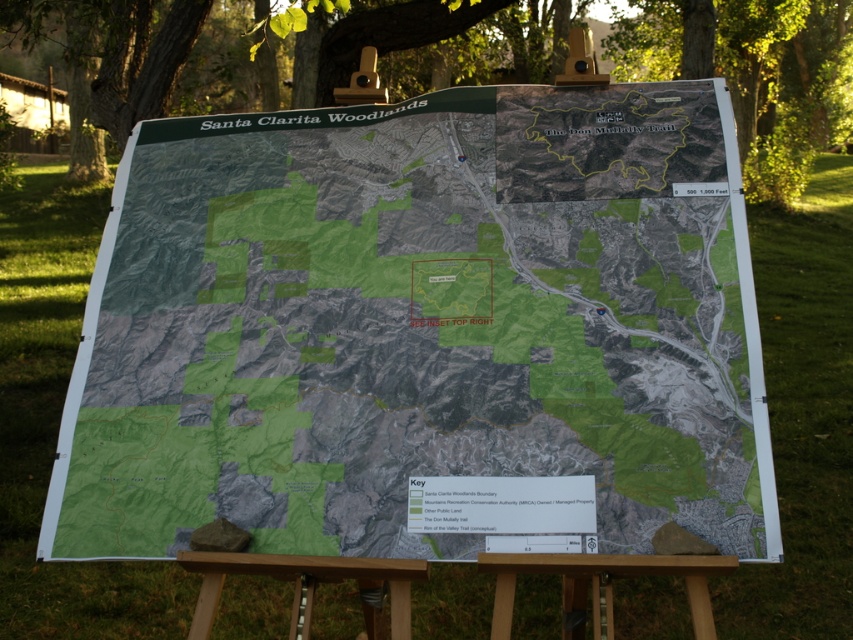
Who is lower down, green textured map at center or green leafy tree at upper center?

green textured map at center

Does green textured map at center have a greater height compared to green leafy tree at upper center?

In fact, green textured map at center may be shorter than green leafy tree at upper center.

This screenshot has width=853, height=640. What do you see at coordinates (422, 332) in the screenshot?
I see `green textured map at center` at bounding box center [422, 332].

At what (x,y) coordinates should I click in order to perform the action: click on green textured map at center. Please return your answer as a coordinate pair (x, y). Looking at the image, I should click on (422, 332).